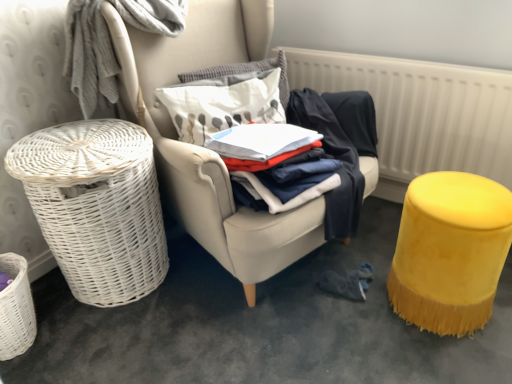
This screenshot has height=384, width=512. I want to click on unoccupied area in front of white wicker basket at left, so click(111, 349).